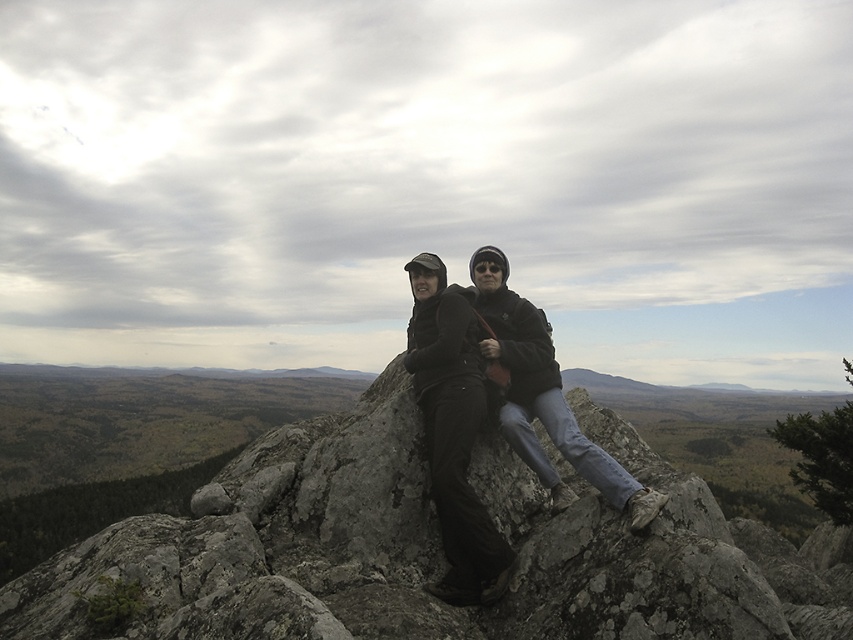
Question: Among these objects, which one is farthest from the camera?

Choices:
 (A) matte black jacket at center
 (B) gray rock at center

Answer: (A)

Question: Is gray rock at center smaller than matte black jacket at center?

Choices:
 (A) no
 (B) yes

Answer: (A)

Question: Can you confirm if gray rock at center is smaller than matte black jacket at center?

Choices:
 (A) yes
 (B) no

Answer: (B)

Question: Can you confirm if gray rock at center is thinner than matte black jacket at center?

Choices:
 (A) no
 (B) yes

Answer: (A)

Question: Which of the following is the farthest from the observer?

Choices:
 (A) gray rock at center
 (B) matte black jacket at center

Answer: (B)